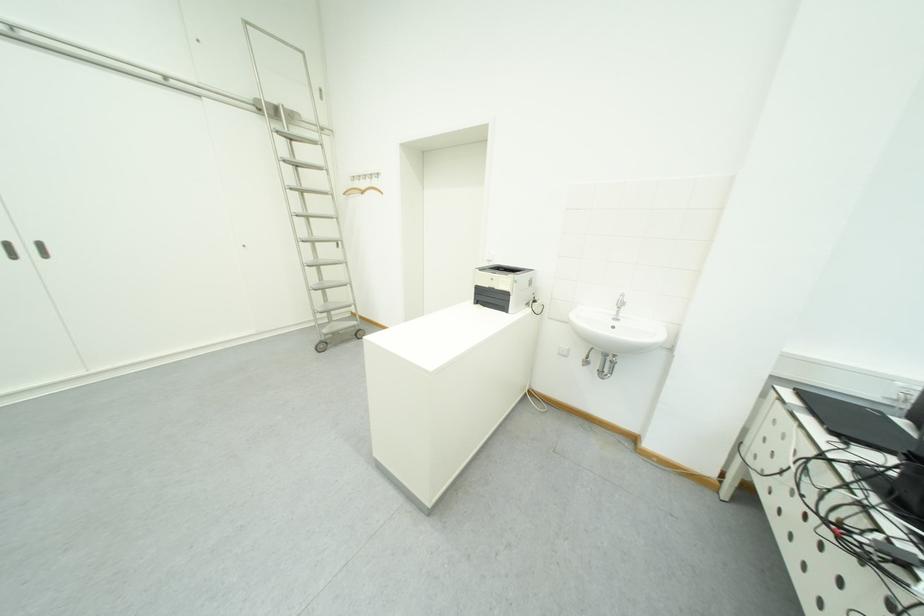
Find where to lift the wooden coat hanger. Please return your answer as a coordinate pair (x, y).

(360, 190)